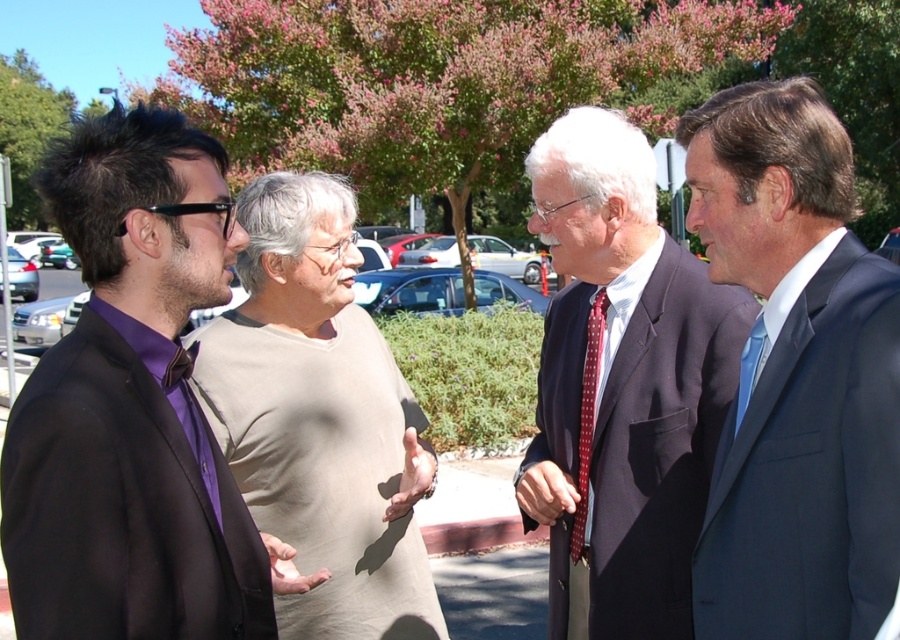
Question: Can you confirm if purple satin bow tie at left is positioned to the left of light beige cotton shirt at center?

Choices:
 (A) yes
 (B) no

Answer: (A)

Question: Based on their relative distances, which object is nearer to the purple satin bow tie at left?

Choices:
 (A) blue silk suit at right
 (B) light beige cotton shirt at center
 (C) dark blue suit at center

Answer: (B)

Question: Which point is farther to the camera?

Choices:
 (A) (324, 380)
 (B) (192, 413)

Answer: (A)

Question: Which object is farther from the camera taking this photo?

Choices:
 (A) blue silk suit at right
 (B) light beige cotton shirt at center

Answer: (B)

Question: Does purple satin bow tie at left have a smaller size compared to dark blue suit at center?

Choices:
 (A) yes
 (B) no

Answer: (A)

Question: Observing the image, what is the correct spatial positioning of purple satin bow tie at left in reference to light beige cotton shirt at center?

Choices:
 (A) right
 (B) left

Answer: (B)